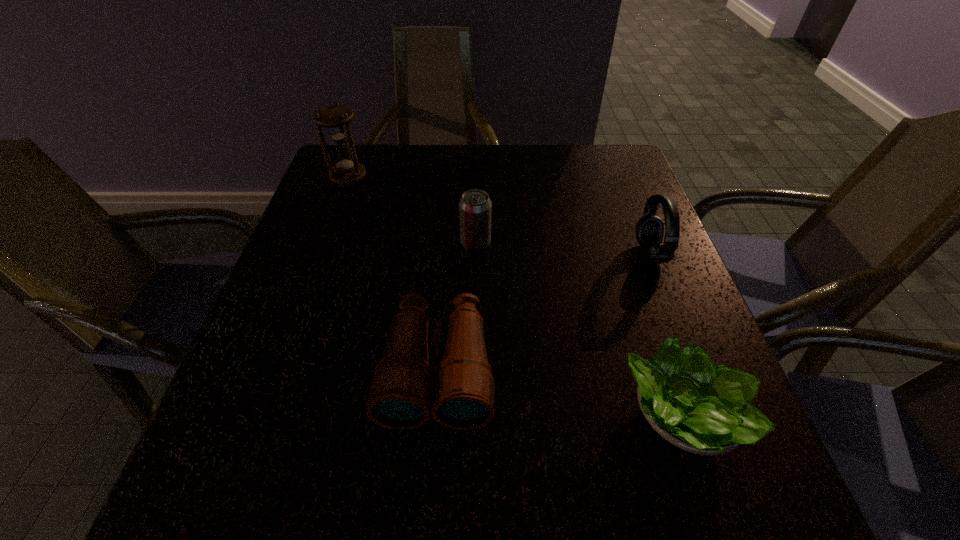
Where is `the tallest object`? Image resolution: width=960 pixels, height=540 pixels. the tallest object is located at coordinates (335, 118).

This screenshot has width=960, height=540. Identify the location of hourglass. [335, 118].

Locate an element on the screen. This screenshot has width=960, height=540. headset is located at coordinates (649, 230).

Identify the location of soda can. The image size is (960, 540). (475, 207).

Where is `binoculars`? The image size is (960, 540). binoculars is located at coordinates (400, 395).

What are the coordinates of `lettuce` in the screenshot? It's located at (694, 406).

This screenshot has height=540, width=960. Find the location of `free space located 0.090m on the back of the leftmost object`. free space located 0.090m on the back of the leftmost object is located at coordinates coord(358,151).

The width and height of the screenshot is (960, 540). Find the location of `free space located on the earcups of the headset`. free space located on the earcups of the headset is located at coordinates (524, 254).

In order to click on free space located on the earcups of the headset in this screenshot , I will do `click(534, 254)`.

Locate an element on the screen. The image size is (960, 540). vacant space situated 0.320m on the earcups of the headset is located at coordinates (492, 254).